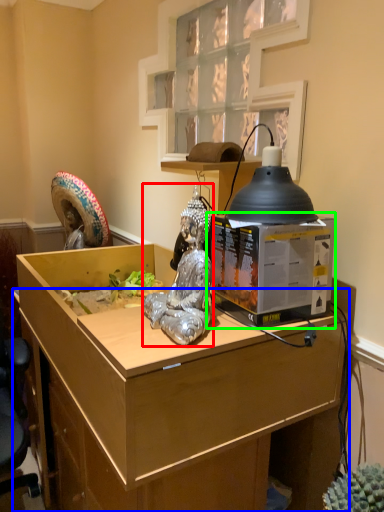
Question: Based on their relative distances, which object is nearer to person (highlighted by a red box)? Choose from desk (highlighted by a blue box) and desktop computer (highlighted by a green box).

Choices:
 (A) desk
 (B) desktop computer

Answer: (B)